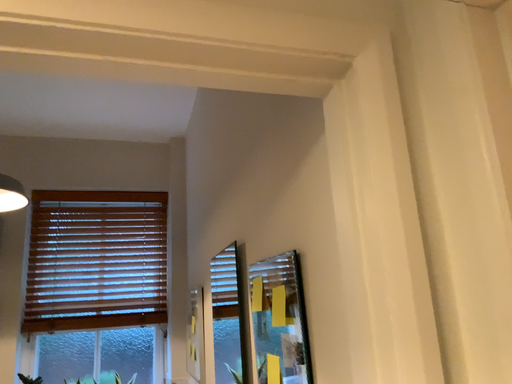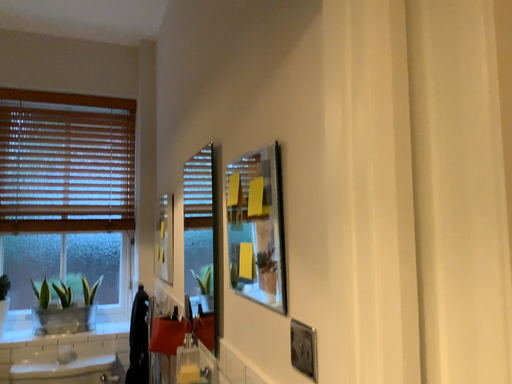
Question: Which way did the camera rotate in the video?

Choices:
 (A) rotated upward
 (B) rotated downward

Answer: (B)